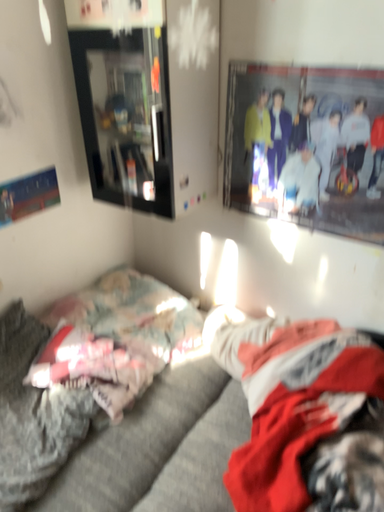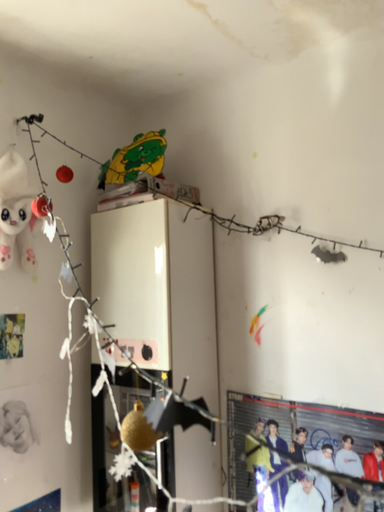
Question: How did the camera likely rotate when shooting the video?

Choices:
 (A) rotated downward
 (B) rotated upward

Answer: (B)